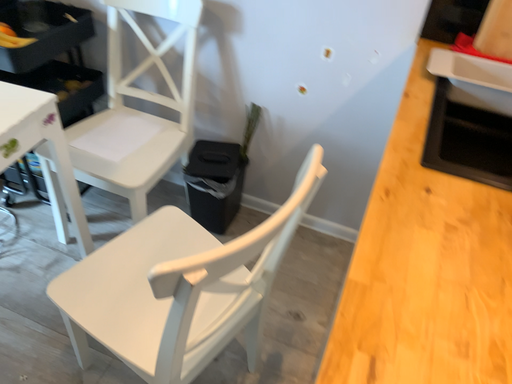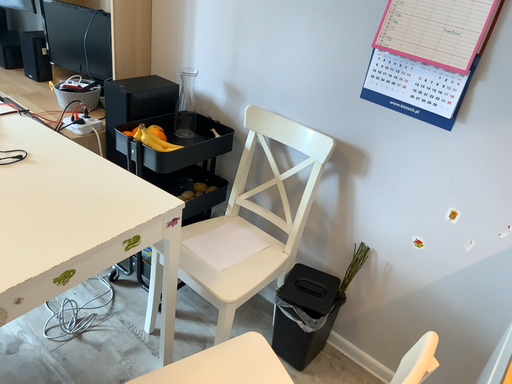
Question: How did the camera likely rotate when shooting the video?

Choices:
 (A) rotated right
 (B) rotated left

Answer: (B)